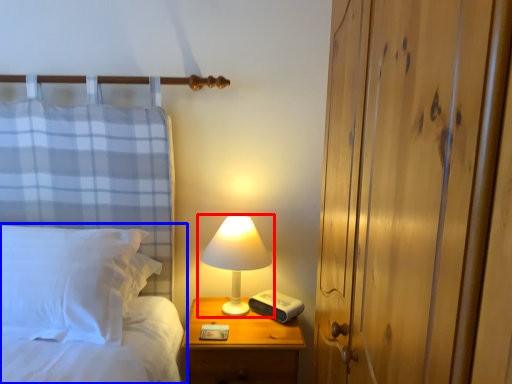
Question: Which of the following is the farthest to the observer, lamp (highlighted by a red box) or bed (highlighted by a blue box)?

Choices:
 (A) lamp
 (B) bed

Answer: (A)